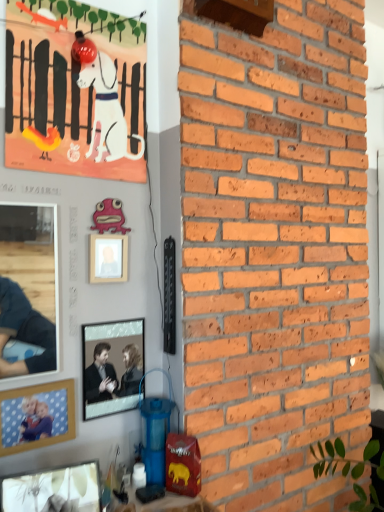
Question: From a real-world perspective, is wooden picture frame at lower left, which is the third picture frame in back-to-front order, under metallic silver picture frame at center, the 2th picture frame in the top-to-bottom sequence?

Choices:
 (A) no
 (B) yes

Answer: (B)

Question: Considering the relative sizes of wooden picture frame at lower left, the third picture frame from the top, and metallic silver picture frame at center, the 2th picture frame in the top-to-bottom sequence, in the image provided, is wooden picture frame at lower left, the third picture frame from the top, bigger than metallic silver picture frame at center, the 2th picture frame in the top-to-bottom sequence,?

Choices:
 (A) no
 (B) yes

Answer: (A)

Question: Is wooden picture frame at lower left, the second picture frame in the front-to-back sequence, at the left side of metallic silver picture frame at center, which is the 3th picture frame in bottom-to-top order?

Choices:
 (A) yes
 (B) no

Answer: (A)

Question: Is the position of wooden picture frame at lower left, the second picture frame when ordered from bottom to top, more distant than that of metallic silver picture frame at center, which appears as the 2th picture frame when viewed from the back?

Choices:
 (A) no
 (B) yes

Answer: (A)

Question: From the image's perspective, does wooden picture frame at lower left, which is the third picture frame in back-to-front order, appear higher than metallic silver picture frame at center, the 2th picture frame in the top-to-bottom sequence?

Choices:
 (A) yes
 (B) no

Answer: (B)

Question: Is wooden picture frame at lower left, the third picture frame from the top, wider than metallic silver picture frame at center, which ranks as the 3th picture frame in front-to-back order?

Choices:
 (A) yes
 (B) no

Answer: (B)

Question: Can you confirm if matte paper poster at upper left is taller than matte glass picture frame at lower left, the 1th picture frame when ordered from bottom to top?

Choices:
 (A) yes
 (B) no

Answer: (A)

Question: Is matte paper poster at upper left next to matte glass picture frame at lower left, which is counted as the fourth picture frame, starting from the top?

Choices:
 (A) yes
 (B) no

Answer: (B)

Question: Would you consider matte paper poster at upper left to be distant from matte glass picture frame at lower left, marked as the fourth picture frame in a back-to-front arrangement?

Choices:
 (A) yes
 (B) no

Answer: (A)

Question: Is matte paper poster at upper left not inside matte glass picture frame at lower left, marked as the fourth picture frame in a back-to-front arrangement?

Choices:
 (A) yes
 (B) no

Answer: (A)

Question: From the image's perspective, would you say matte paper poster at upper left is shown under matte glass picture frame at lower left, which ranks as the first picture frame in front-to-back order?

Choices:
 (A) no
 (B) yes

Answer: (A)

Question: From a real-world perspective, is matte paper poster at upper left over matte glass picture frame at lower left, which is counted as the fourth picture frame, starting from the top?

Choices:
 (A) yes
 (B) no

Answer: (A)

Question: Does matte paper poster at upper left appear on the right side of pink wood picture frame at upper center, arranged as the first picture frame when viewed from the top?

Choices:
 (A) no
 (B) yes

Answer: (A)